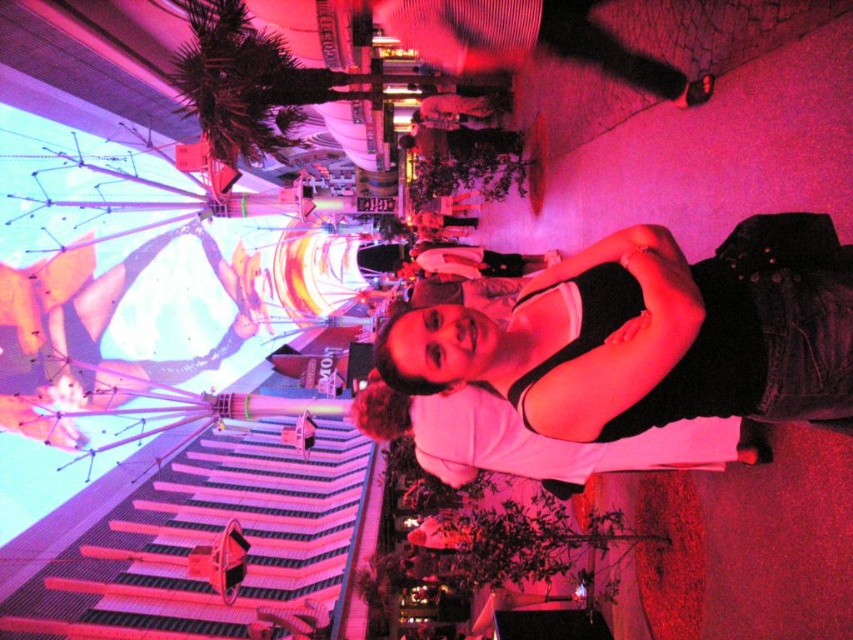
Does black denim jacket at center have a lesser width compared to white matte shirt at center?

No, black denim jacket at center is not thinner than white matte shirt at center.

Which is in front, point (770, 227) or point (91, 248)?

Point (770, 227) is more forward.

From the picture: Who is more distant from viewer, (x=413, y=372) or (x=119, y=362)?

Point (x=119, y=362)

The height and width of the screenshot is (640, 853). Find the location of `black denim jacket at center`. black denim jacket at center is located at coordinates (654, 333).